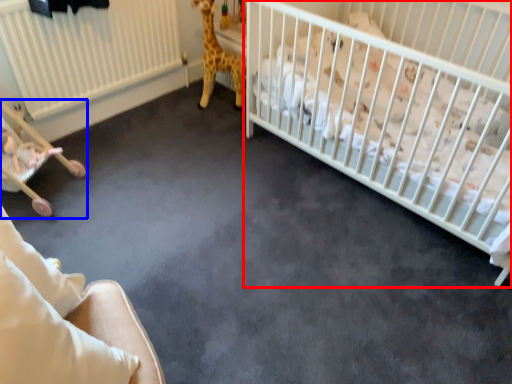
Question: Among these objects, which one is nearest to the camera, infant bed (highlighted by a red box) or baby carriage (highlighted by a blue box)?

Choices:
 (A) infant bed
 (B) baby carriage

Answer: (A)